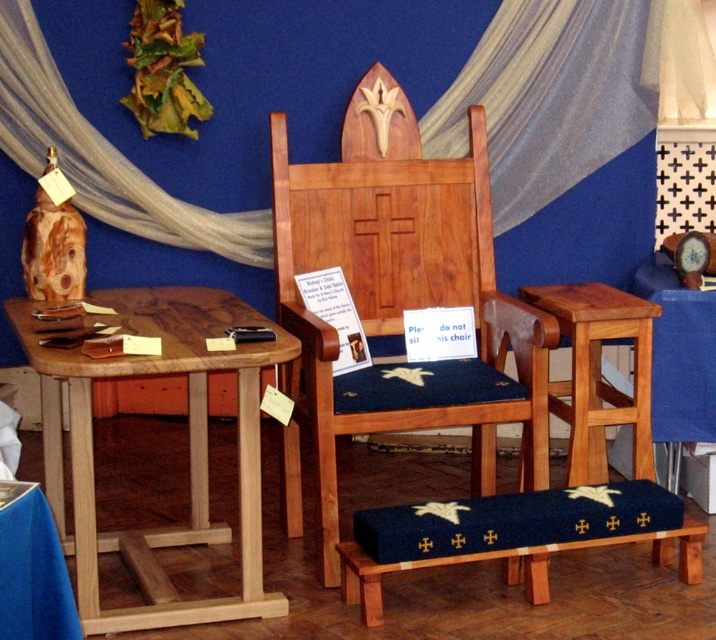
Is point (135, 577) less distant than point (21, 515)?

No, it is behind (21, 515).

Is point (149, 362) positioned after point (43, 564)?

Yes, it is behind point (43, 564).

This screenshot has height=640, width=716. I want to click on natural wood table at left, so click(x=188, y=449).

What do you see at coordinates (400, 296) in the screenshot? I see `wooden chair at center` at bounding box center [400, 296].

Can you confirm if wooden chair at center is positioned above natural wood table at left?

Correct, wooden chair at center is located above natural wood table at left.

Is point (469, 198) in front of point (274, 340)?

No, (469, 198) is behind (274, 340).

Identify the location of wooden chair at center. (400, 296).

Can you confirm if wooden chair at center is bigger than white sheer fabric at upper left?

Yes, wooden chair at center is bigger than white sheer fabric at upper left.

In the scene shown: Is wooden chair at center smaller than white sheer fabric at upper left?

Actually, wooden chair at center might be larger than white sheer fabric at upper left.

In order to click on wooden chair at center in this screenshot , I will do `click(400, 296)`.

This screenshot has height=640, width=716. I want to click on wooden chair at center, so click(400, 296).